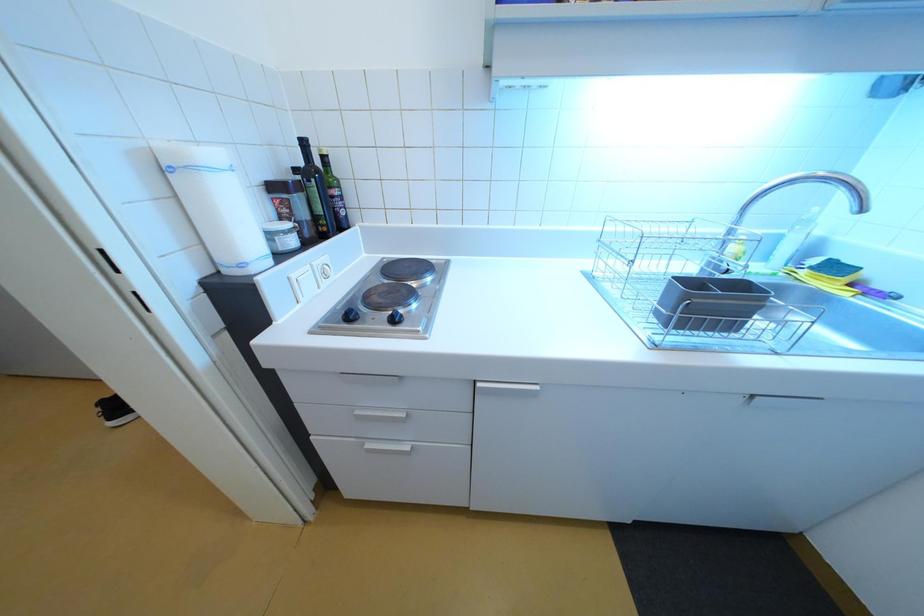
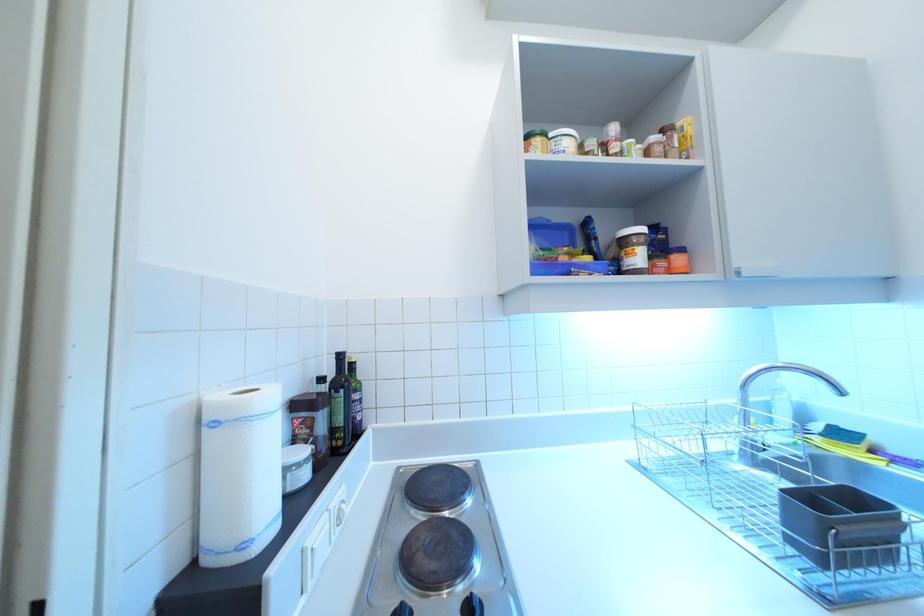
Question: Based on the continuous images, in which direction is the camera rotating? Reply with the corresponding letter.

Choices:
 (A) Left
 (B) Right
 (C) Up
 (D) Down

Answer: (C)